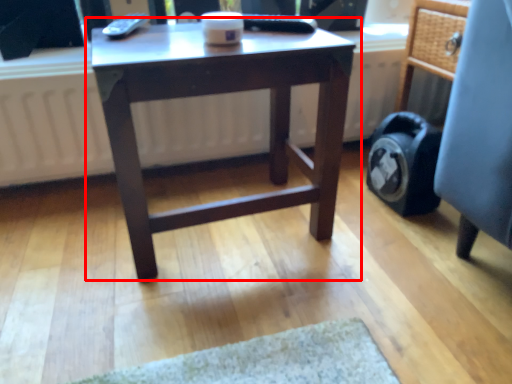
Question: From the image's perspective, what is the correct spatial positioning of table (annotated by the red box) in reference to computer chair?

Choices:
 (A) below
 (B) above

Answer: (A)